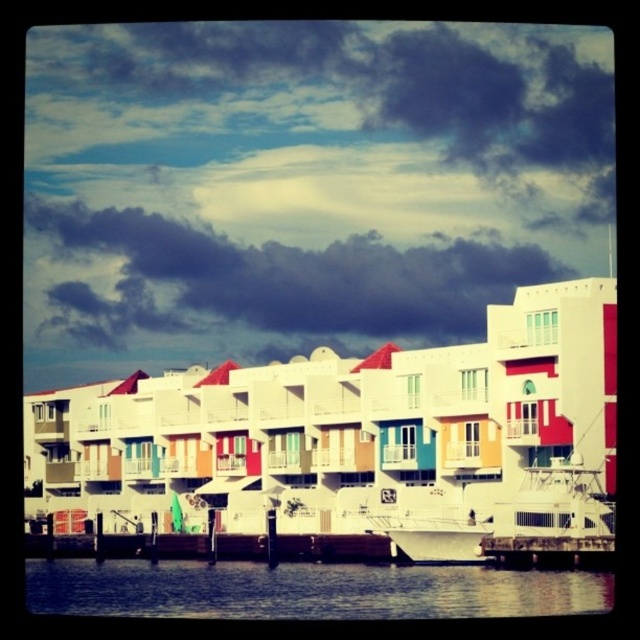
You are an architect analyzing a waterfront design. You observe the dark cloudy sky at upper center and the wooden at lower center in the scene. Which of these two elements has a greater horizontal span from left to right?

The dark cloudy sky at upper center has a larger width than the wooden at lower center, so it has a greater horizontal span from left to right.

You are an artist planning to paint the waterfront scene. You want to ensure the dark cloudy sky at upper center and the blue water at lower center are proportionally accurate. Which object should you make wider in your painting?

The dark cloudy sky at upper center should be made wider than the blue water at lower center because its width surpasses the blue water at lower center according to the description.